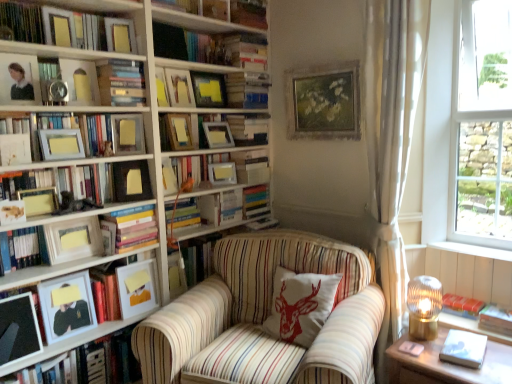
Question: From the image's perspective, does hardcover book at right, the first paperback book when ordered from right to left, appear higher than matte gold picture frame at left, the 14th picture frame when ordered from right to left?

Choices:
 (A) no
 (B) yes

Answer: (A)

Question: Is hardcover book at right, the first paperback book when ordered from right to left, shorter than matte gold picture frame at left, which appears as the fourth picture frame when viewed from the left?

Choices:
 (A) no
 (B) yes

Answer: (B)

Question: Is matte gold picture frame at left, the 14th picture frame when ordered from right to left, surrounded by hardcover book at right, the second paperback book when ordered from left to right?

Choices:
 (A) no
 (B) yes

Answer: (A)

Question: Is hardcover book at right, the second paperback book when ordered from left to right, not inside matte gold picture frame at left, the 14th picture frame when ordered from right to left?

Choices:
 (A) no
 (B) yes

Answer: (B)

Question: Does hardcover book at right, the first paperback book when ordered from right to left, have a greater height compared to matte gold picture frame at left, the 14th picture frame when ordered from right to left?

Choices:
 (A) no
 (B) yes

Answer: (A)

Question: From the image's perspective, would you say hardcover book at right, the first paperback book when ordered from right to left, is shown under matte gold picture frame at left, which appears as the fourth picture frame when viewed from the left?

Choices:
 (A) no
 (B) yes

Answer: (B)

Question: Is matte black picture frame at lower left, arranged as the seventeenth picture frame when viewed from the right, closer to the viewer compared to matte gold picture frame at lower left, the 3th picture frame positioned from the left?

Choices:
 (A) yes
 (B) no

Answer: (A)

Question: From the image's perspective, is matte black picture frame at lower left, the 1th picture frame viewed from the left, under matte gold picture frame at lower left, the 3th picture frame positioned from the left?

Choices:
 (A) no
 (B) yes

Answer: (B)

Question: From the image's perspective, is matte black picture frame at lower left, the 1th picture frame viewed from the left, on matte gold picture frame at lower left, the fifteenth picture frame viewed from the right?

Choices:
 (A) yes
 (B) no

Answer: (B)

Question: Is matte gold picture frame at lower left, the fifteenth picture frame viewed from the right, a part of matte black picture frame at lower left, arranged as the seventeenth picture frame when viewed from the right?

Choices:
 (A) yes
 (B) no

Answer: (B)

Question: Can you confirm if matte black picture frame at lower left, the 1th picture frame viewed from the left, is taller than matte gold picture frame at lower left, the 3th picture frame positioned from the left?

Choices:
 (A) yes
 (B) no

Answer: (A)

Question: Would you consider matte black picture frame at lower left, the 1th picture frame viewed from the left, to be distant from matte gold picture frame at lower left, the fifteenth picture frame viewed from the right?

Choices:
 (A) yes
 (B) no

Answer: (B)

Question: Considering the relative sizes of wooden picture frame at upper center, the 1th picture frame from the right, and matte wooden picture frame at upper center, placed as the fourth picture frame when sorted from right to left, in the image provided, is wooden picture frame at upper center, the 1th picture frame from the right, shorter than matte wooden picture frame at upper center, placed as the fourth picture frame when sorted from right to left,?

Choices:
 (A) no
 (B) yes

Answer: (A)